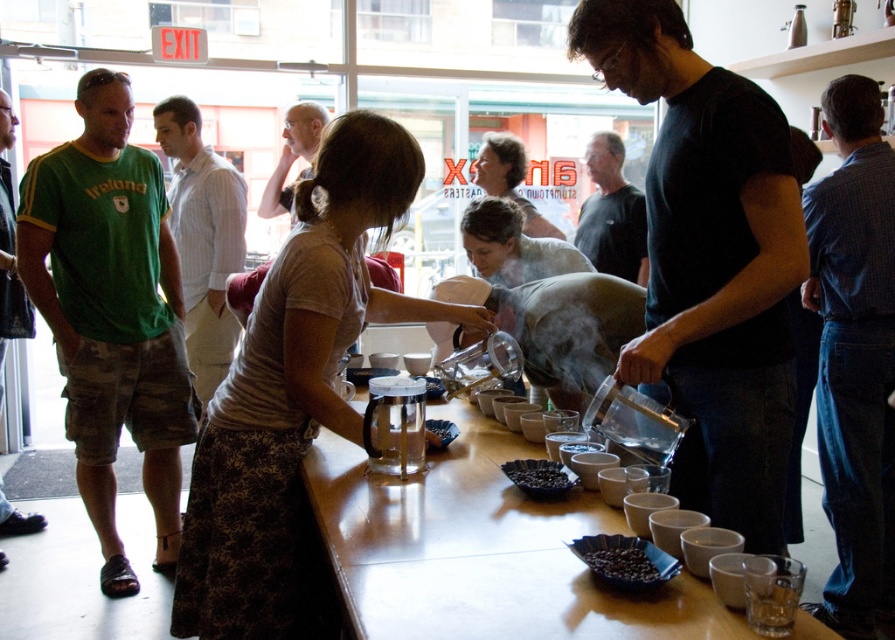
You are a barista who needs to reach the dark matte coffee beans at center while standing by the white striped shirt at left. Considering the distance between them is 8.51 feet, can you comfortably stretch to get them without moving your feet?

The white striped shirt at left is 8.51 feet away from the dark matte coffee beans at center. Since the average comfortable reaching distance for an adult is about 2 to 3 feet, stretching 8.51 feet without moving would be difficult and uncomfortable. You should take a step forward.

You are a barista working at the coffee shop. You need to place a new batch of dark matte coffee beans at center onto the wooden table at center. Can you move them directly to the table without moving any other items?

The wooden table at center is positioned on the left side of dark matte coffee beans at center, so you can move the dark matte coffee beans at center to the wooden table at center directly since they are adjacent to each other.